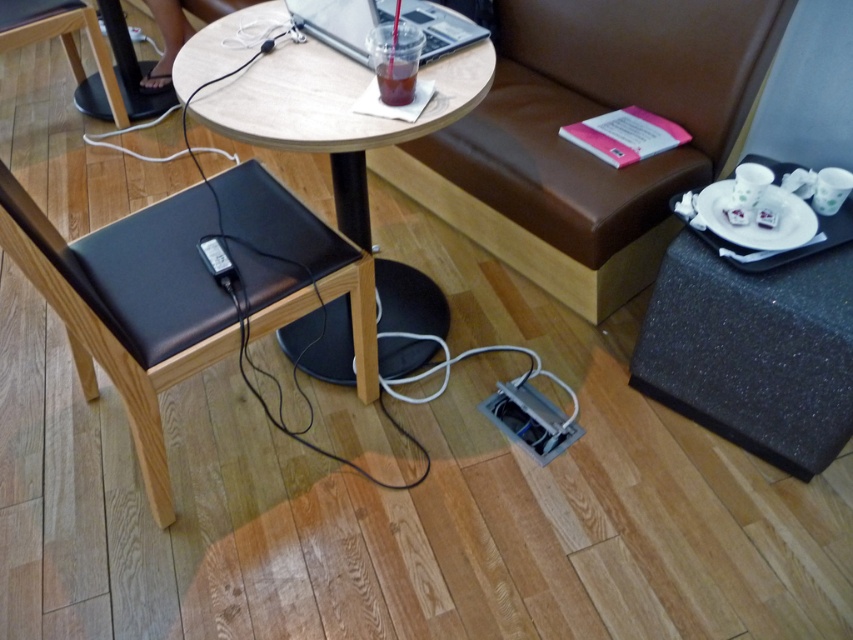
Question: Which of these objects is positioned closest to the silver metallic laptop at center?

Choices:
 (A) wooden table at center
 (B) black textured tray at right
 (C) brown leather couch at upper center
 (D) black leather chair at left

Answer: (A)

Question: Is black textured tray at right wider than silver metallic laptop at center?

Choices:
 (A) yes
 (B) no

Answer: (B)

Question: Can you confirm if wooden table at center is bigger than translucent plastic cup at center?

Choices:
 (A) yes
 (B) no

Answer: (A)

Question: Which point is farther to the camera?

Choices:
 (A) (657, 250)
 (B) (741, 410)
 (C) (408, 67)

Answer: (A)

Question: Which object appears farthest from the camera in this image?

Choices:
 (A) translucent plastic cup at center
 (B) wooden table at center
 (C) silver metallic laptop at center
 (D) brown leather couch at upper center

Answer: (D)

Question: Can you confirm if black leather chair at left is positioned above black textured tray at right?

Choices:
 (A) yes
 (B) no

Answer: (B)